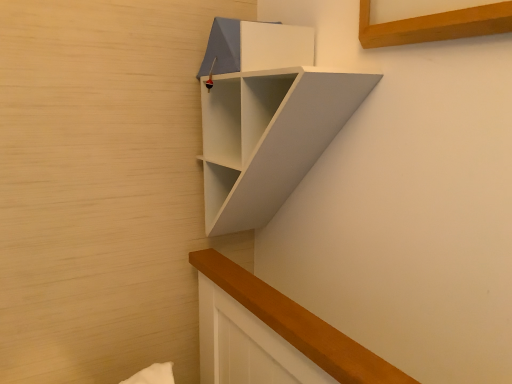
Question: Is white matte shelf at upper center wider or thinner than white matte cabinet at upper center?

Choices:
 (A) wide
 (B) thin

Answer: (A)

Question: In the image, is white matte shelf at upper center positioned in front of or behind white matte cabinet at upper center?

Choices:
 (A) behind
 (B) front

Answer: (B)

Question: From a real-world perspective, relative to white matte cabinet at upper center, is white matte shelf at upper center vertically above or below?

Choices:
 (A) below
 (B) above

Answer: (A)

Question: From their relative heights in the image, would you say white matte cabinet at upper center is taller or shorter than white matte shelf at upper center?

Choices:
 (A) tall
 (B) short

Answer: (B)

Question: Is white matte cabinet at upper center bigger or smaller than white matte shelf at upper center?

Choices:
 (A) big
 (B) small

Answer: (B)

Question: From the image's perspective, relative to white matte shelf at upper center, is white matte cabinet at upper center above or below?

Choices:
 (A) above
 (B) below

Answer: (A)

Question: Considering the positions of white matte cabinet at upper center and white matte shelf at upper center in the image, is white matte cabinet at upper center wider or thinner than white matte shelf at upper center?

Choices:
 (A) wide
 (B) thin

Answer: (B)